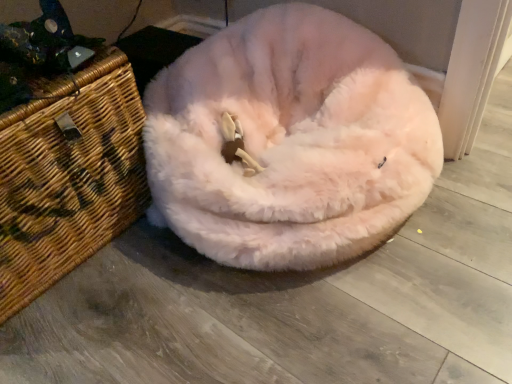
Question: Which is correct: woven brown basket at left is inside fuzzy white dog bed at center, or outside of it?

Choices:
 (A) outside
 (B) inside

Answer: (A)

Question: From a real-world perspective, is woven brown basket at left above or below fuzzy white dog bed at center?

Choices:
 (A) below
 (B) above

Answer: (B)

Question: Relative to fuzzy white dog bed at center, is woven brown basket at left in front or behind?

Choices:
 (A) front
 (B) behind

Answer: (B)

Question: Considering their positions, is fuzzy white dog bed at center located in front of or behind woven brown basket at left?

Choices:
 (A) behind
 (B) front

Answer: (B)

Question: Is fuzzy white dog bed at center bigger or smaller than woven brown basket at left?

Choices:
 (A) big
 (B) small

Answer: (A)

Question: Based on their positions, is fuzzy white dog bed at center located to the left or right of woven brown basket at left?

Choices:
 (A) left
 (B) right

Answer: (B)

Question: Considering the positions of fuzzy white dog bed at center and woven brown basket at left in the image, is fuzzy white dog bed at center taller or shorter than woven brown basket at left?

Choices:
 (A) short
 (B) tall

Answer: (A)